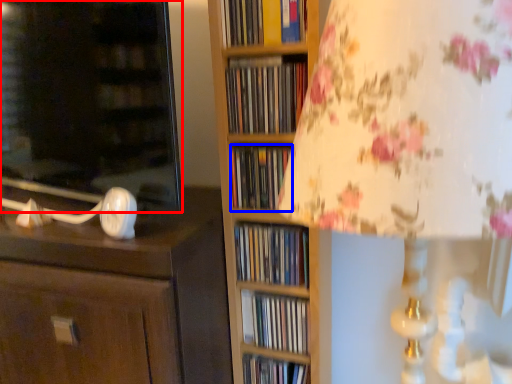
Question: Which object appears farthest to the camera in this image, cabinetry (highlighted by a red box) or book (highlighted by a blue box)?

Choices:
 (A) cabinetry
 (B) book

Answer: (B)